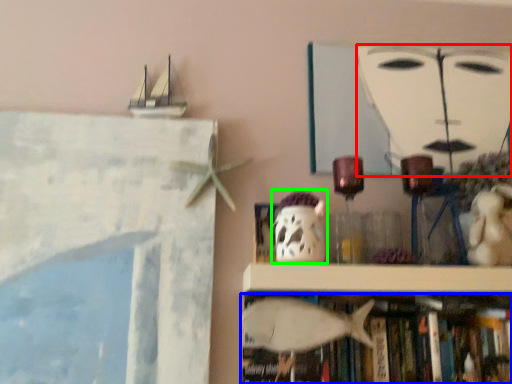
Question: Based on their relative distances, which object is farther from human face (highlighted by a red box)? Choose from book (highlighted by a blue box) and ghost (highlighted by a green box).

Choices:
 (A) book
 (B) ghost

Answer: (A)